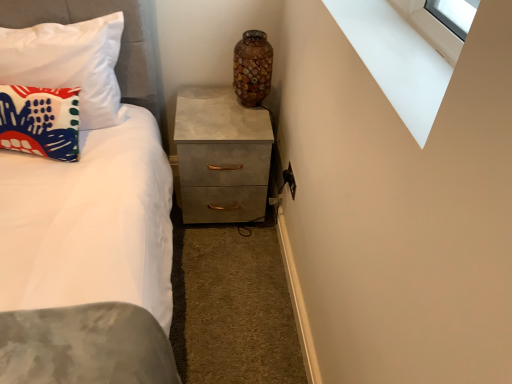
You are a GUI agent. You are given a task and a screenshot of the screen. Output one action in this format:
    pyautogui.click(x=<x>, y=<y>)
    Task: Click on the vacant space in front of mosaic glass vase at upper center
    
    Given the screenshot: What is the action you would take?
    pyautogui.click(x=237, y=120)